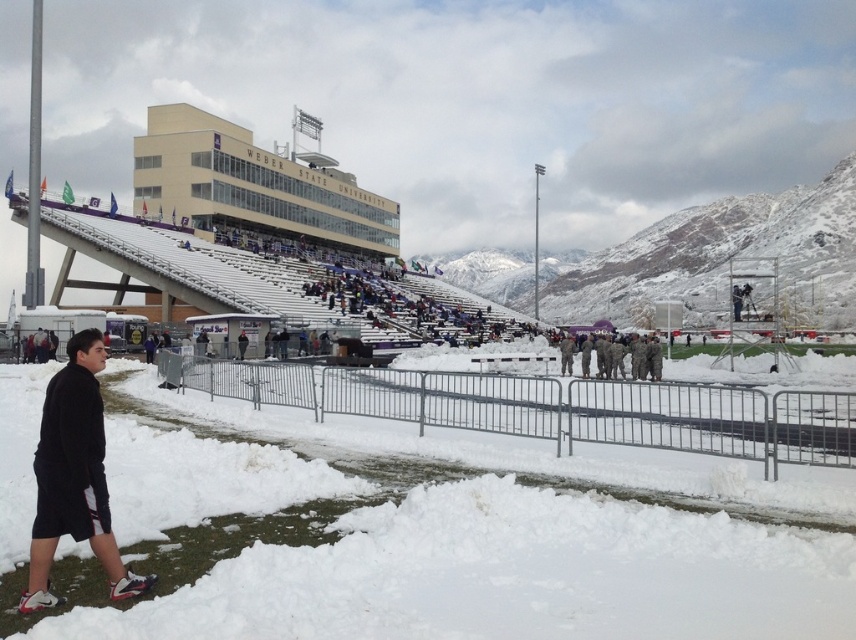
Question: Is white fluffy snow at lower left wider than black matte shorts at lower left?

Choices:
 (A) no
 (B) yes

Answer: (B)

Question: Is matte beige building at upper center bigger than camouflage fabric soldiers at center?

Choices:
 (A) yes
 (B) no

Answer: (A)

Question: Among these objects, which one is farthest from the camera?

Choices:
 (A) camouflage fabric soldiers at center
 (B) white fluffy snow at lower left
 (C) matte beige building at upper center

Answer: (C)

Question: Which object is positioned farthest from the white fluffy snow at lower left?

Choices:
 (A) matte beige building at upper center
 (B) black matte shorts at lower left
 (C) camouflage fabric soldiers at center

Answer: (A)

Question: Is the position of white fluffy snow at lower left more distant than that of matte beige building at upper center?

Choices:
 (A) yes
 (B) no

Answer: (B)

Question: Considering the real-world distances, which object is farthest from the white fluffy snow at lower left?

Choices:
 (A) camouflage fabric soldiers at center
 (B) matte beige building at upper center
 (C) black matte shorts at lower left

Answer: (B)